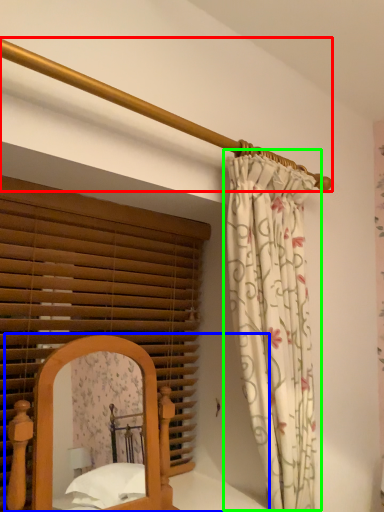
Question: Based on their relative distances, which object is farther from balustrade (highlighted by a red box)? Choose from bed (highlighted by a blue box) and curtain (highlighted by a green box).

Choices:
 (A) bed
 (B) curtain

Answer: (A)